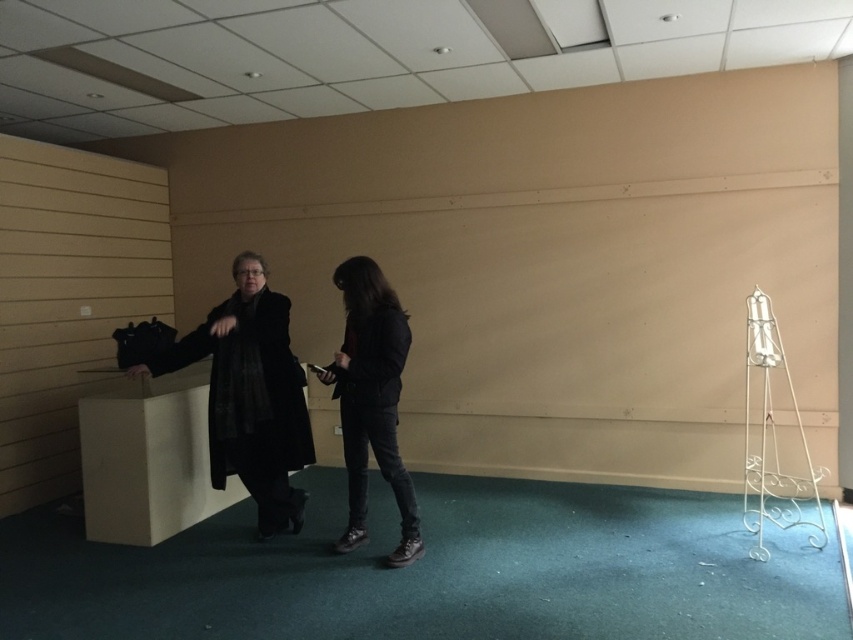
Can you confirm if matte black coat at left is taller than matte black jacket at center?

Yes, matte black coat at left is taller than matte black jacket at center.

Which is more to the left, matte black coat at left or matte black jacket at center?

matte black coat at left is more to the left.

Is point (212, 477) closer to camera compared to point (418, 522)?

No, (212, 477) is behind (418, 522).

Image resolution: width=853 pixels, height=640 pixels. Find the location of `matte black coat at left`. matte black coat at left is located at coordinates (251, 396).